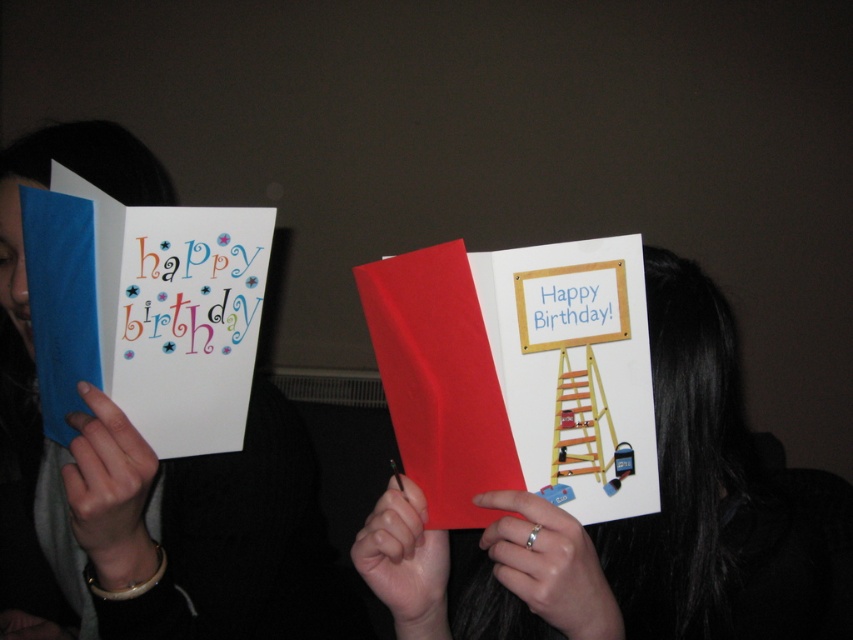
You are trying to find the matte white greeting card at left and the wooden ladder at center in a dimly lit room. Which object is positioned higher in the image?

The matte white greeting card at left is above the wooden ladder at center, so it is positioned higher in the image.

You are organizing a birthday party and need to decide which item to place on the gift table. The white paper card at center and the wooden ladder at center are both candidates. Based on their sizes, which one is taller?

The white paper card at center is taller than the wooden ladder at center according to the description.

You are standing in a room with two points marked on the floor. The first point is at location point [810,582] and the second point is at point [236,216]. If you want to walk from the first point to the second point, will you pass through the area where the birthday cards are being held?

Yes, because point [810,582] is behind point [236,216], meaning the path from the first to the second point would go through the area where the birthday cards are held.